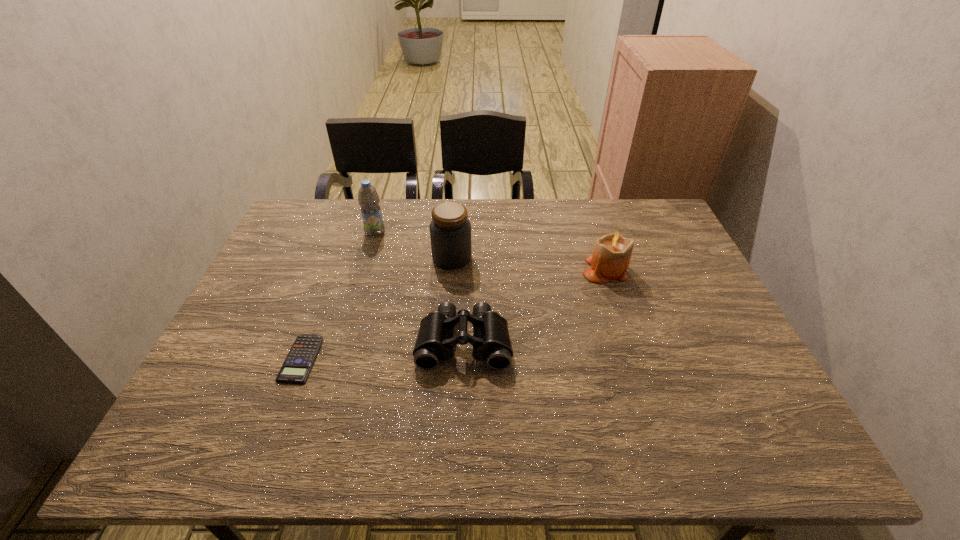
You are a GUI agent. You are given a task and a screenshot of the screen. Output one action in this format:
    pyautogui.click(x=<x>, y=<y>)
    Task: Click on the free space located on the front of the rightmost object
    This screenshot has height=540, width=960.
    Given the screenshot: What is the action you would take?
    pyautogui.click(x=644, y=389)

Identify the location of vacant space located 0.160m on the front-facing side of the fourth tallest object. This screenshot has height=540, width=960. (461, 436).

Where is `vacant region located on the back of the leftmost object`? vacant region located on the back of the leftmost object is located at coordinates (331, 278).

This screenshot has width=960, height=540. Find the location of `object that is at the far edge`. object that is at the far edge is located at coordinates (368, 198).

At what (x,y) coordinates should I click in order to perform the action: click on vacant space at the far edge. Please return your answer as a coordinate pair (x, y). The image size is (960, 540). Looking at the image, I should click on (588, 212).

Identify the location of blank space at the near edge. This screenshot has width=960, height=540. (265, 439).

In the image, there is a desktop. At what (x,y) coordinates should I click in order to perform the action: click on free region at the left edge. Please return your answer as a coordinate pair (x, y). Looking at the image, I should click on (279, 262).

At what (x,y) coordinates should I click in order to perform the action: click on vacant region at the right edge. Please return your answer as a coordinate pair (x, y). This screenshot has height=540, width=960. Looking at the image, I should click on (680, 318).

The height and width of the screenshot is (540, 960). Identify the location of vacant space at the far left corner of the desktop. (326, 213).

Where is `vacant region between the leftmost object and the second shortest object`? Image resolution: width=960 pixels, height=540 pixels. vacant region between the leftmost object and the second shortest object is located at coordinates (382, 350).